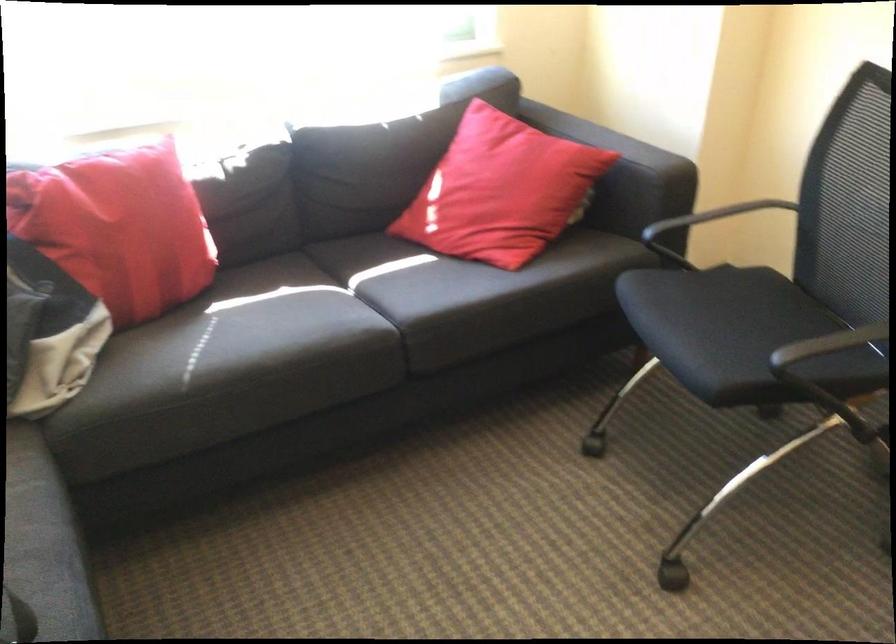
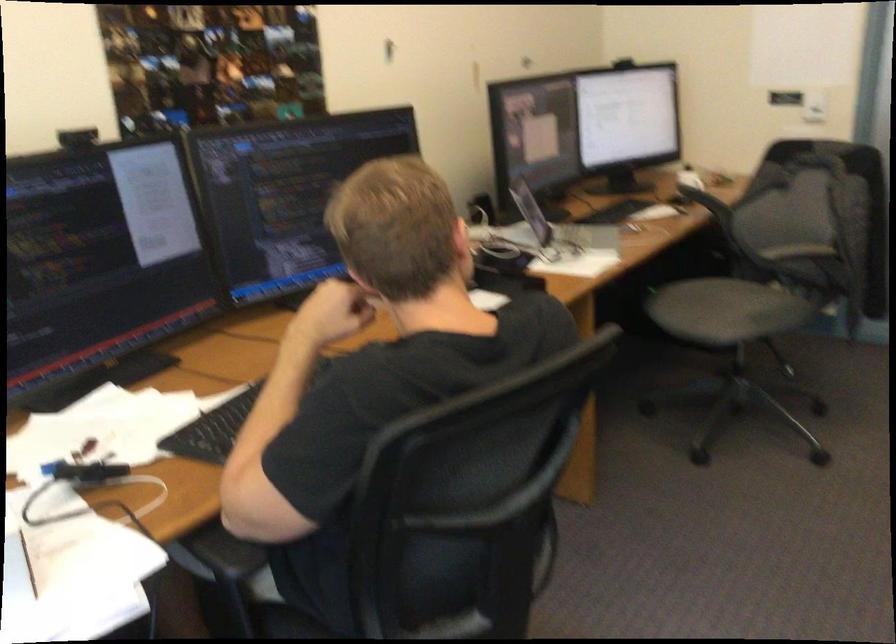
The images are taken continuously from a first-person perspective. In which direction is your viewpoint rotating?

The camera's rotation is toward right-down.